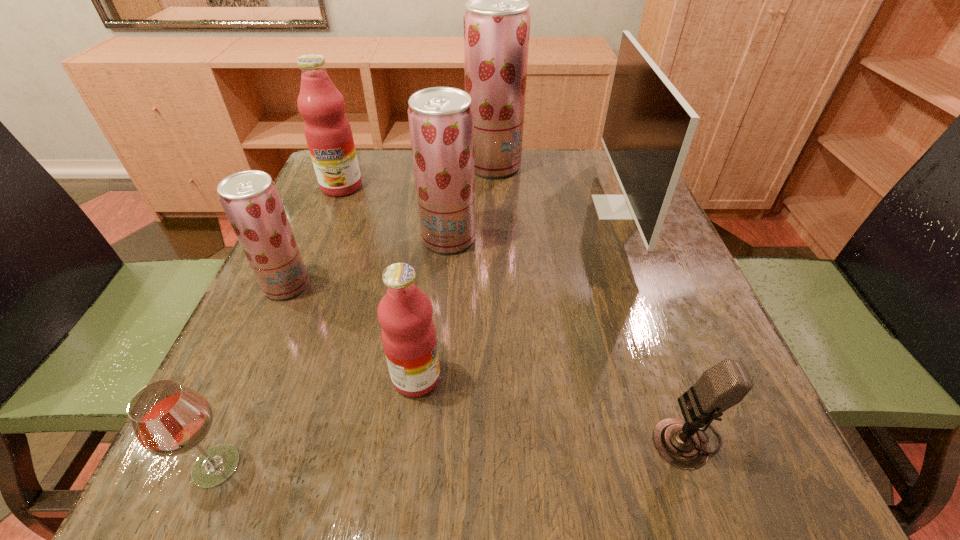
Find the location of a particular element. The width and height of the screenshot is (960, 540). the nearest fruit juice is located at coordinates (404, 313).

Find the location of `microphone`. microphone is located at coordinates (680, 442).

Where is `wineglass`? wineglass is located at coordinates (169, 419).

Identify the location of vacant space located on the front of the tallest fruit juice. Image resolution: width=960 pixels, height=540 pixels. (x=499, y=289).

I want to click on vacant space located 0.290m on the front-facing side of the monitor, so click(469, 207).

The height and width of the screenshot is (540, 960). In order to click on vacant area located on the front-facing side of the monitor in this screenshot , I will do [444, 207].

You are a GUI agent. You are given a task and a screenshot of the screen. Output one action in this format:
    pyautogui.click(x=<x>, y=<y>)
    Task: Click on the vacant space located on the front-facing side of the monitor
    The height and width of the screenshot is (540, 960).
    Given the screenshot: What is the action you would take?
    pyautogui.click(x=448, y=207)

Where is `vacant region located on the back of the third nearest fruit juice`? The image size is (960, 540). vacant region located on the back of the third nearest fruit juice is located at coordinates (455, 161).

Image resolution: width=960 pixels, height=540 pixels. Identify the location of vacant space located 0.240m on the label of the left pink fruit juice. (309, 267).

Where is `vacant space situated 0.230m on the front of the fourth farthest fruit juice`? vacant space situated 0.230m on the front of the fourth farthest fruit juice is located at coordinates (228, 418).